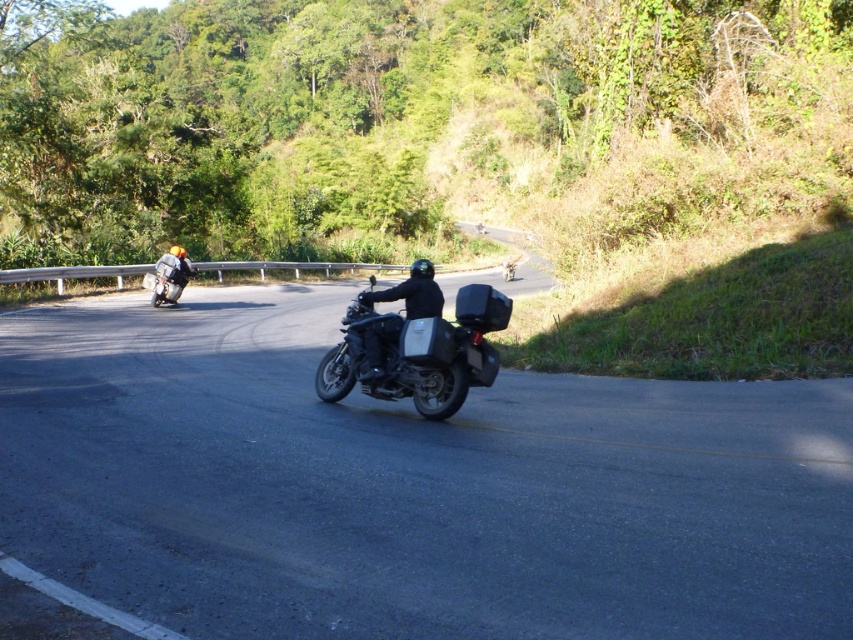
Question: Is black asphalt road at center further to the viewer compared to matte black motorcycle at left?

Choices:
 (A) no
 (B) yes

Answer: (A)

Question: Which point is closer to the camera?

Choices:
 (A) matte black motorcycle at left
 (B) black matte motorcycle at center

Answer: (B)

Question: Which point is farther to the camera?

Choices:
 (A) black matte motorcycle at center
 (B) matte black motorcycle at left
 (C) matte black motorcycle at center
 (D) black asphalt road at center

Answer: (B)

Question: Does black matte motorcycle at center have a greater width compared to matte black motorcycle at left?

Choices:
 (A) no
 (B) yes

Answer: (A)

Question: Is black asphalt road at center smaller than matte black motorcycle at left?

Choices:
 (A) no
 (B) yes

Answer: (A)

Question: Among these points, which one is farthest from the camera?

Choices:
 (A) (178, 285)
 (B) (318, 284)
 (C) (364, 372)

Answer: (B)